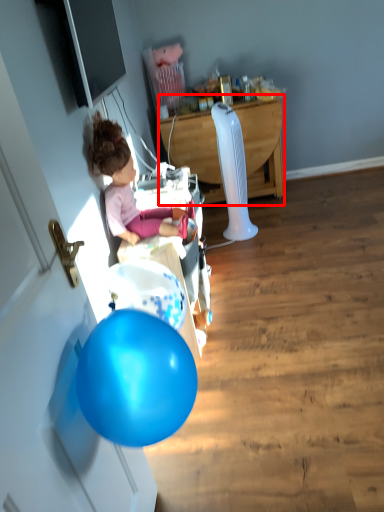
Question: From the image's perspective, what is the correct spatial relationship of desk (annotated by the red box) in relation to person?

Choices:
 (A) below
 (B) above

Answer: (B)